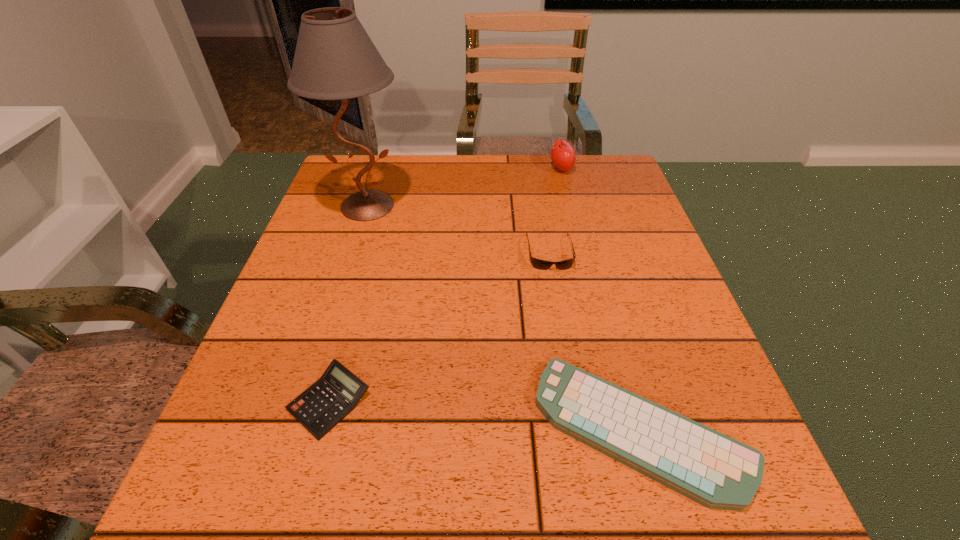
Where is `blank space located 0.180m on the right of the calculator`? blank space located 0.180m on the right of the calculator is located at coordinates (481, 401).

Where is `free space located on the left of the computer keyboard`? The image size is (960, 540). free space located on the left of the computer keyboard is located at coordinates (421, 429).

Locate an element on the screen. This screenshot has height=540, width=960. table lamp situated at the far edge is located at coordinates (335, 59).

The width and height of the screenshot is (960, 540). What are the coordinates of `apple positioned at the far edge` in the screenshot? It's located at (563, 156).

You are a GUI agent. You are given a task and a screenshot of the screen. Output one action in this format:
    pyautogui.click(x=<x>, y=<y>)
    Task: Click on the object that is at the near edge
    The height and width of the screenshot is (540, 960).
    Given the screenshot: What is the action you would take?
    pyautogui.click(x=714, y=470)

This screenshot has width=960, height=540. Find the location of `table lamp present at the left edge`. table lamp present at the left edge is located at coordinates (335, 59).

Find the location of a particular element. This screenshot has width=960, height=540. calculator that is positioned at the left edge is located at coordinates tap(323, 405).

The height and width of the screenshot is (540, 960). I want to click on apple that is at the right edge, so click(x=563, y=156).

Identify the location of computer keyboard that is at the right edge. (714, 470).

Find the location of a particular element. The height and width of the screenshot is (540, 960). object that is at the far left corner is located at coordinates (335, 59).